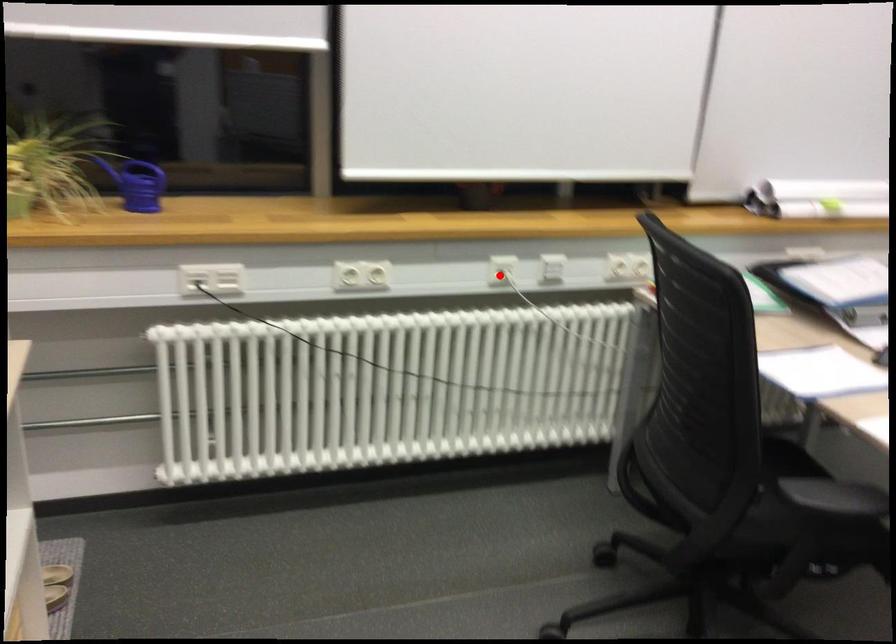
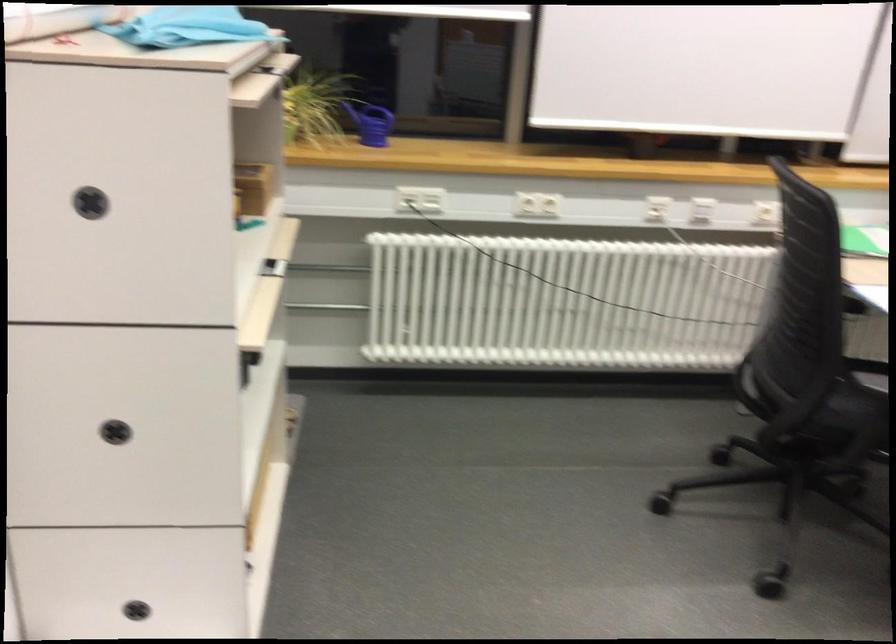
In the second image, find the point that corresponds to the highlighted location in the first image.

(657, 209)